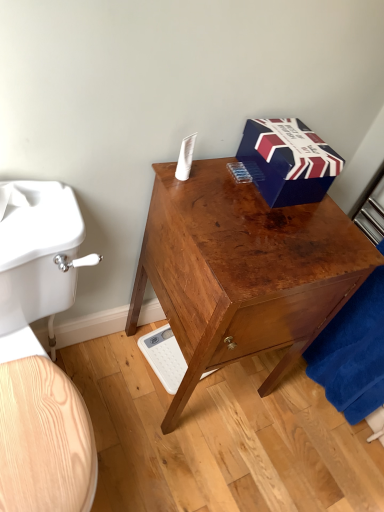
Where is `vacant area that lies in front of shiny brown wooden desk at center`? vacant area that lies in front of shiny brown wooden desk at center is located at coordinates (188, 456).